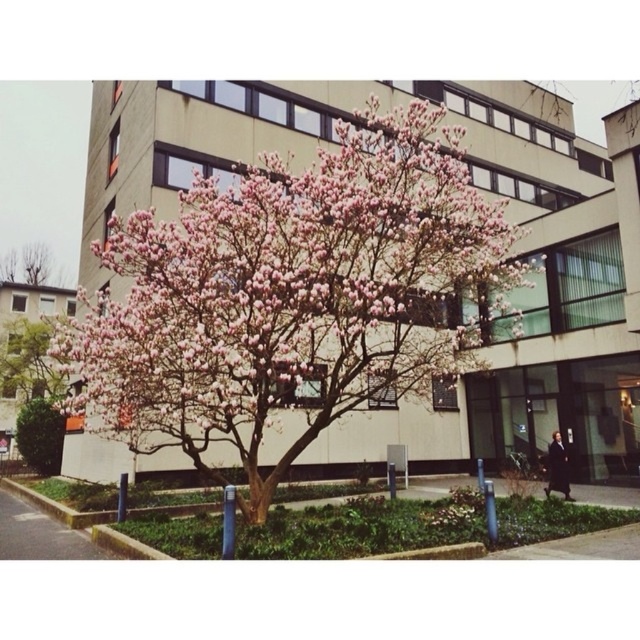
Question: Does pink bloom tree at center have a lesser width compared to pink bloom tree at left?

Choices:
 (A) yes
 (B) no

Answer: (B)

Question: Is pink bloom tree at center below pink bloom tree at upper left?

Choices:
 (A) yes
 (B) no

Answer: (A)

Question: Which of the following is the closest to the observer?

Choices:
 (A) (19, 358)
 (B) (150, 362)
 (C) (20, 252)

Answer: (B)

Question: Can you confirm if pink bloom tree at left is thinner than pink bloom tree at upper left?

Choices:
 (A) no
 (B) yes

Answer: (B)

Question: Which object appears closest to the camera in this image?

Choices:
 (A) pink bloom tree at upper left
 (B) pink bloom tree at left
 (C) pink bloom tree at center

Answer: (C)

Question: Which of the following is the closest to the observer?

Choices:
 (A) (32, 266)
 (B) (301, 371)

Answer: (B)